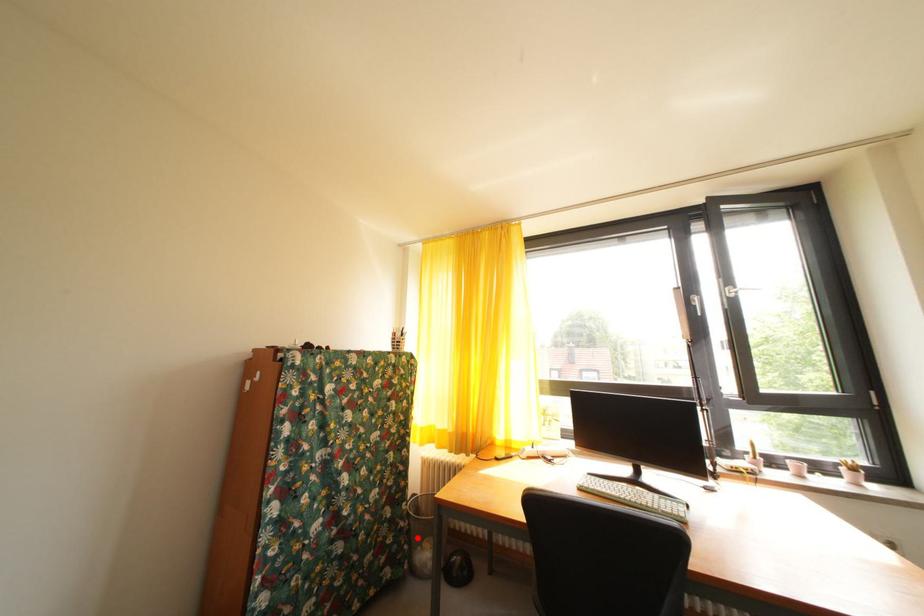
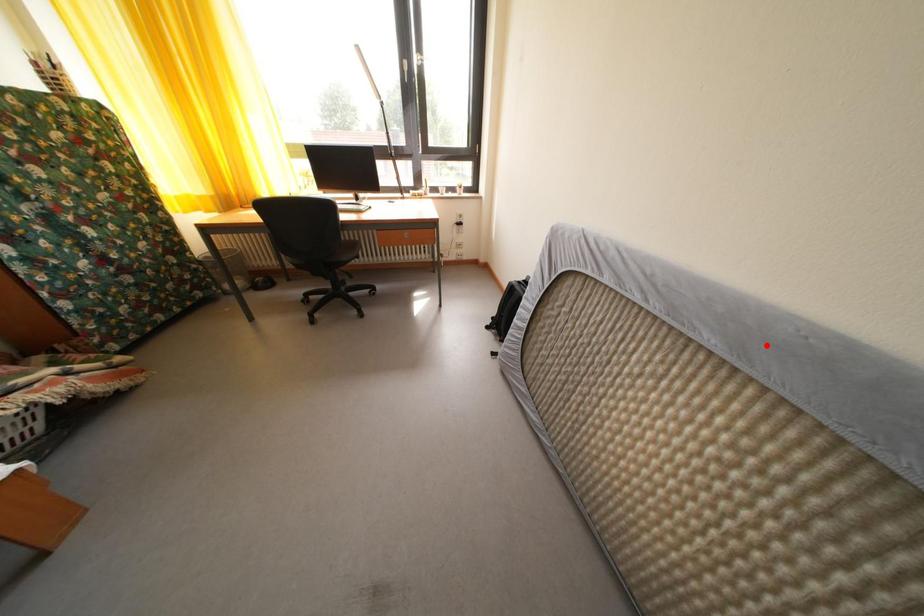
I am providing you with two images of the same scene from different viewpoints. A red point is marked on the first image and another point is marked on the second image. Is the red point in image1 aligned with the point shown in image2?

No